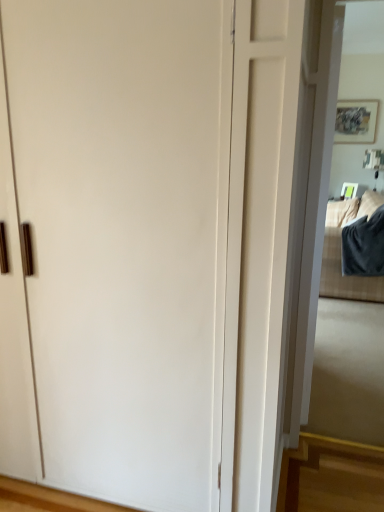
Question: Is dark gray plush blanket at right wider than white glossy mirror at right?

Choices:
 (A) no
 (B) yes

Answer: (B)

Question: Can you confirm if dark gray plush blanket at right is positioned to the left of white glossy mirror at right?

Choices:
 (A) no
 (B) yes

Answer: (A)

Question: From the image's perspective, would you say dark gray plush blanket at right is positioned over white glossy mirror at right?

Choices:
 (A) no
 (B) yes

Answer: (B)

Question: Is dark gray plush blanket at right oriented away from white glossy mirror at right?

Choices:
 (A) yes
 (B) no

Answer: (B)

Question: Can you confirm if dark gray plush blanket at right is thinner than white glossy mirror at right?

Choices:
 (A) yes
 (B) no

Answer: (B)

Question: Is dark gray plush blanket at right shorter than white glossy mirror at right?

Choices:
 (A) yes
 (B) no

Answer: (A)

Question: From a real-world perspective, is white glossy mirror at right under dark gray plush blanket at right?

Choices:
 (A) no
 (B) yes

Answer: (A)

Question: Is white glossy mirror at right behind dark gray plush blanket at right?

Choices:
 (A) no
 (B) yes

Answer: (A)

Question: From a real-world perspective, is white glossy mirror at right on dark gray plush blanket at right?

Choices:
 (A) no
 (B) yes

Answer: (B)

Question: From the image's perspective, is white glossy mirror at right located above dark gray plush blanket at right?

Choices:
 (A) no
 (B) yes

Answer: (A)

Question: Can you confirm if white glossy mirror at right is taller than dark gray plush blanket at right?

Choices:
 (A) no
 (B) yes

Answer: (B)

Question: Is dark gray plush blanket at right surrounded by white glossy mirror at right?

Choices:
 (A) yes
 (B) no

Answer: (B)

Question: Is white glossy mirror at right situated inside dark gray plush blanket at right or outside?

Choices:
 (A) inside
 (B) outside

Answer: (B)